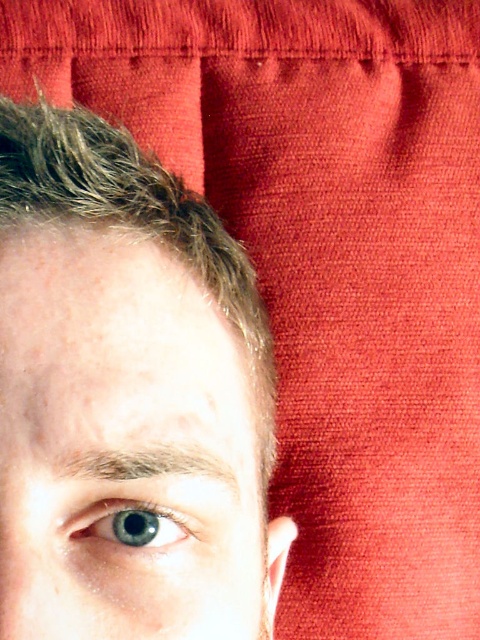
Locate an element on the screen. blue matte eye at center is located at coordinates (123, 445).

Is point (91, 394) in front of point (163, 547)?

Yes, point (91, 394) is in front of point (163, 547).

What are the coordinates of `blue matte eye at center` in the screenshot? It's located at (123, 445).

Image resolution: width=480 pixels, height=640 pixels. What are the coordinates of `blue matte eye at center` in the screenshot? It's located at (123, 445).